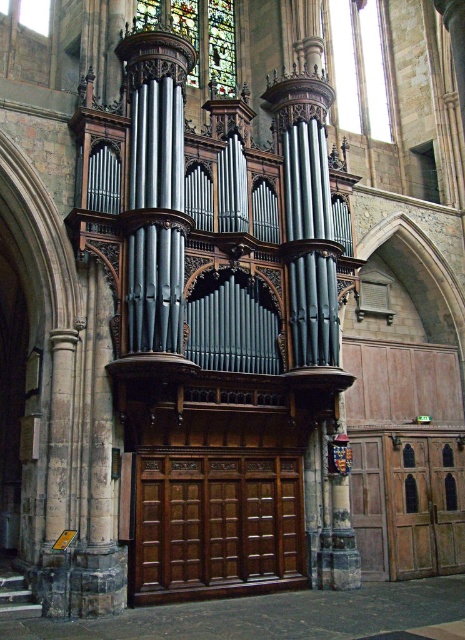
You are an architect designing a new cathedral and want to ensure proper ventilation. You notice the clear glass at upper center and the stained glass at upper center. Which of these two glasses is taller and would allow more airflow?

The clear glass at upper center has a greater height compared to the stained glass at upper center, so it would allow more airflow.

You are standing in the cathedral and want to know how far you are from the point marked as point (x=353, y=125). Can you determine the distance?

The distance between you and point (x=353, y=125) is 220.45 feet.